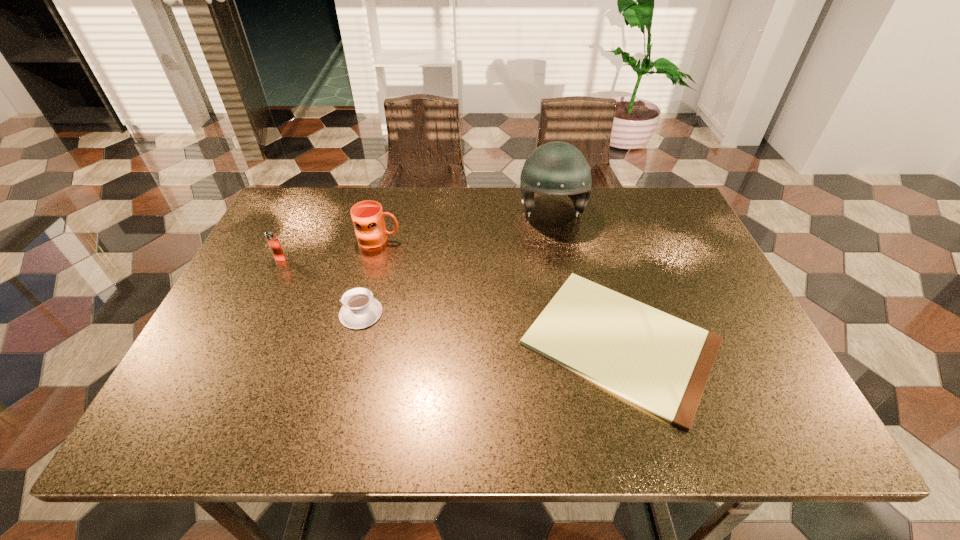
This screenshot has width=960, height=540. In order to click on vacant area that lies between the mug and the third tallest object in this screenshot , I will do `click(329, 249)`.

At what (x,y) coordinates should I click in order to perform the action: click on vacant point located between the shortest object and the leftmost object. Please return your answer as a coordinate pair (x, y). This screenshot has width=960, height=540. Looking at the image, I should click on (450, 300).

Identify the location of empty space that is in between the football helmet and the second shortest object. (456, 262).

In order to click on vacant space that's between the football helmet and the clipboard in this screenshot , I will do `click(586, 277)`.

Where is `free space that is in between the mug and the leftmost object`? The image size is (960, 540). free space that is in between the mug and the leftmost object is located at coordinates pyautogui.click(x=329, y=249).

You are a GUI agent. You are given a task and a screenshot of the screen. Output one action in this format:
    pyautogui.click(x=<x>, y=<y>)
    Task: Click on the free space between the mug and the second shortest object
    This screenshot has height=540, width=960.
    Given the screenshot: What is the action you would take?
    pyautogui.click(x=371, y=276)

Find the location of `object that ranks as the closest to the shortest object`. object that ranks as the closest to the shortest object is located at coordinates (556, 168).

You are a GUI agent. You are given a task and a screenshot of the screen. Output one action in this format:
    pyautogui.click(x=<x>, y=<y>)
    Task: Click on the object that is the closest to the igniter
    
    Given the screenshot: What is the action you would take?
    pyautogui.click(x=367, y=216)

Find the location of a particular element. free point that satisfies the following two spatial constraints: 1. on the handle side of the teacup; 2. on the back side of the shortest object is located at coordinates (353, 342).

Where is `vacant area that satisfies the following two spatial constraints: 1. on the handle side of the teacup; 2. on the back side of the clipboard`? Image resolution: width=960 pixels, height=540 pixels. vacant area that satisfies the following two spatial constraints: 1. on the handle side of the teacup; 2. on the back side of the clipboard is located at coordinates (353, 342).